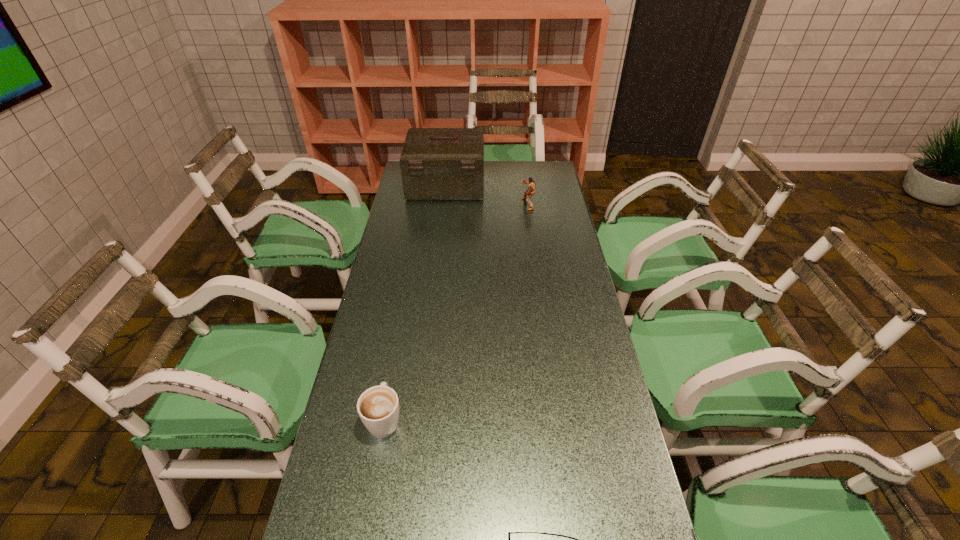
Where is `the tallest object`? the tallest object is located at coordinates [x=436, y=163].

At what (x,y) coordinates should I click in order to perform the action: click on puncher. Please return your answer as a coordinate pair (x, y). Image resolution: width=960 pixels, height=540 pixels. Looking at the image, I should click on (528, 194).

The height and width of the screenshot is (540, 960). In order to click on cappuccino in this screenshot , I will do `click(378, 407)`.

Where is `the second nearest object`? the second nearest object is located at coordinates (378, 407).

Where is `vacant position located on the right of the tallest object`? The image size is (960, 540). vacant position located on the right of the tallest object is located at coordinates (516, 185).

Locate an element on the screen. vacant area situated 0.170m on the front-facing side of the third shortest object is located at coordinates pos(482,205).

Image resolution: width=960 pixels, height=540 pixels. I want to click on free spot located 0.320m on the front-facing side of the third shortest object, so click(448, 205).

You are a GUI agent. You are given a task and a screenshot of the screen. Output one action in this format:
    pyautogui.click(x=<x>, y=<y>)
    Task: Click on the vacant space located 0.320m on the front-facing side of the third shortest object
    
    Given the screenshot: What is the action you would take?
    pyautogui.click(x=448, y=205)

Where is `vacant space located with the handle on the side of the second nearest object`? The image size is (960, 540). vacant space located with the handle on the side of the second nearest object is located at coordinates (403, 313).

Find the location of a particular element. vacant space located 0.260m with the handle on the side of the second nearest object is located at coordinates 401,326.